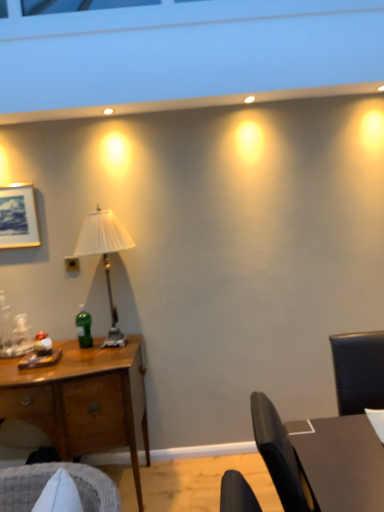
Image resolution: width=384 pixels, height=512 pixels. I want to click on free spot in front of green glass bottle at center-left, so click(x=79, y=358).